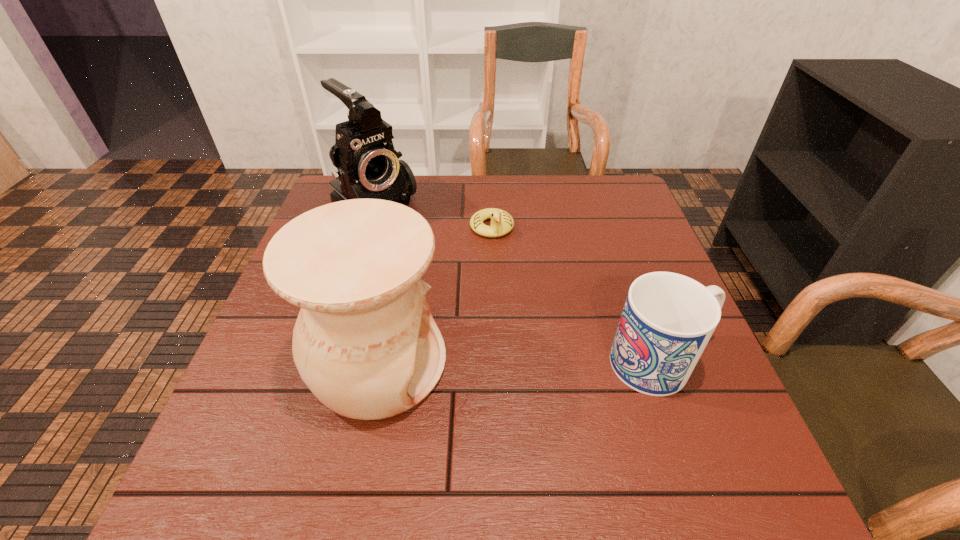
Locate an element on the screen. object situated at the far left corner is located at coordinates (368, 167).

Find the location of a particular element. The image size is (960, 540). object that is positioned at the near left corner is located at coordinates 365,343.

This screenshot has width=960, height=540. Identify the location of free spot at the far edge of the desktop. [x=561, y=219].

Where is `vacant space at the near edge`? This screenshot has height=540, width=960. vacant space at the near edge is located at coordinates (616, 405).

In the image, there is a desktop. Where is `vacant space at the left edge`? vacant space at the left edge is located at coordinates (273, 312).

This screenshot has width=960, height=540. In the image, there is a desktop. Find the location of `free space at the right edge`. free space at the right edge is located at coordinates (625, 272).

In the image, there is a desktop. Find the location of `vacant space at the near left corner`. vacant space at the near left corner is located at coordinates (259, 410).

Find the location of `blank space at the far right corner`. blank space at the far right corner is located at coordinates (610, 188).

At what (x,y) coordinates should I click in order to perform the action: click on free space between the camcorder and the duckling. Please return your answer as a coordinate pair (x, y). This screenshot has width=960, height=540. Looking at the image, I should click on (433, 221).

Identify the location of free space that is in between the rightmost object and the pottery. This screenshot has height=540, width=960. pyautogui.click(x=520, y=363).